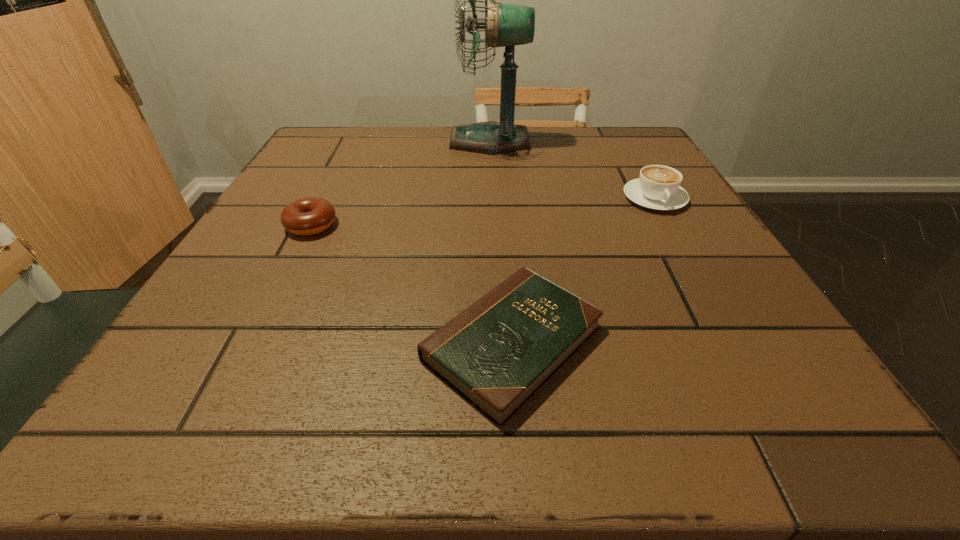
You are a GUI agent. You are given a task and a screenshot of the screen. Output one action in this format:
    pyautogui.click(x=<x>, y=<y>)
    Task: Click on the vacant area at the left edge
    The image size is (960, 540).
    Given the screenshot: What is the action you would take?
    pyautogui.click(x=334, y=221)

Locate an element on the screen. vacant space at the right edge of the desktop is located at coordinates (620, 208).

Find the location of a particular element. The image size is (960, 540). vacant space at the far left corner is located at coordinates (352, 157).

This screenshot has width=960, height=540. I want to click on free space between the leftmost object and the tallest object, so click(400, 183).

The width and height of the screenshot is (960, 540). Find the location of `free space between the third tallest object and the Bible`. free space between the third tallest object and the Bible is located at coordinates (412, 284).

I want to click on blank region between the shortest object and the tallest object, so click(x=501, y=242).

The image size is (960, 540). I want to click on vacant area that lies between the doughnut and the nearest object, so click(412, 284).

Identify the location of free space between the doughnut and the nearest object. (412, 284).

Where is `vacant area that lies between the doughnut and the Bible`? The height and width of the screenshot is (540, 960). vacant area that lies between the doughnut and the Bible is located at coordinates (412, 284).

This screenshot has height=540, width=960. Find the location of `vacant area that lies between the farthest object and the rightmost object`. vacant area that lies between the farthest object and the rightmost object is located at coordinates (572, 170).